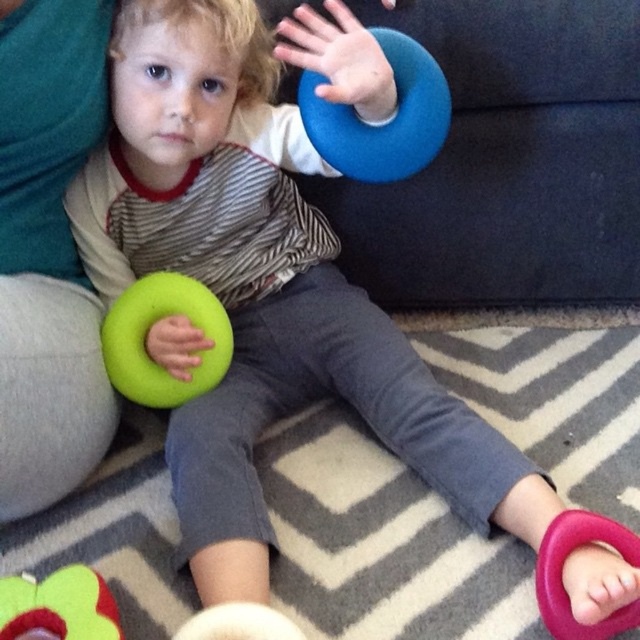
You are a toy organizer who needs to place the green foam ring at lower left and the pink rubber ring at lower right into storage boxes. If the boxes are the same size and shape, which ring can be placed into the box without needing to adjust its position?

The green foam ring at lower left is further to the viewer than the pink rubber ring at lower right, so it is closer to the observer. Since both boxes are the same size and shape, the green foam ring at lower left can be placed into the box without needing to adjust its position because it is closer and fits within the box dimensions.

The child is trying to place the green foam ring at lower left over the soft plush flower at lower left. Based on their sizes, will the ring fit over the flower?

The green foam ring at lower left might be wider than soft plush flower at lower left, so there is a possibility that the ring may not fit over the flower if its width exceeds the flower.

Please describe the exact position of the green foam ring at lower left in the image using coordinates.

The green foam ring at lower left is located at coordinates 0.516 on the x axis and 0.247 on the y axis.